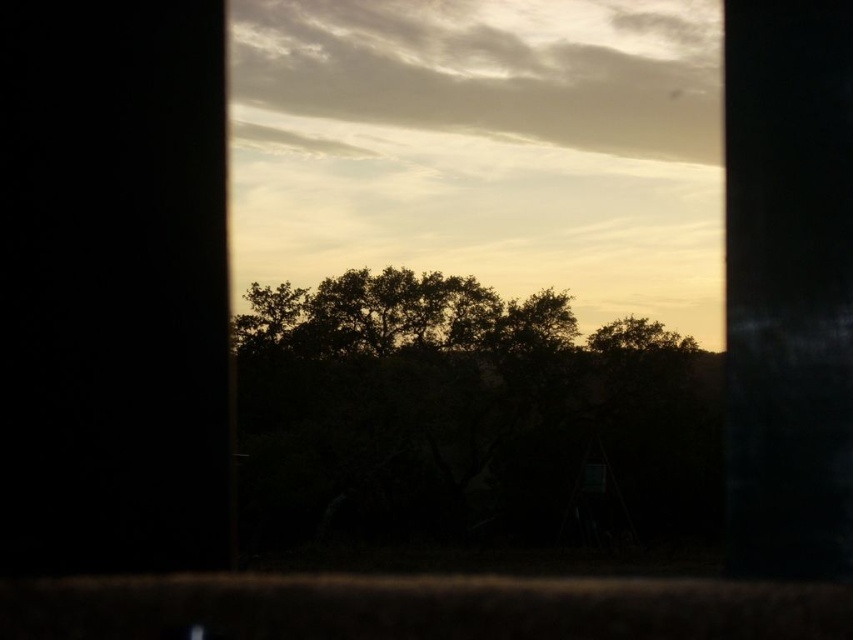
Is transparent glass window at upper center closer to camera compared to silhouette leafy tree at center?

Yes.

Does transparent glass window at upper center have a smaller size compared to silhouette leafy tree at center?

Incorrect, transparent glass window at upper center is not smaller in size than silhouette leafy tree at center.

Is point (685, 532) closer to camera compared to point (349, 424)?

That is False.

This screenshot has width=853, height=640. I want to click on transparent glass window at upper center, so click(x=474, y=280).